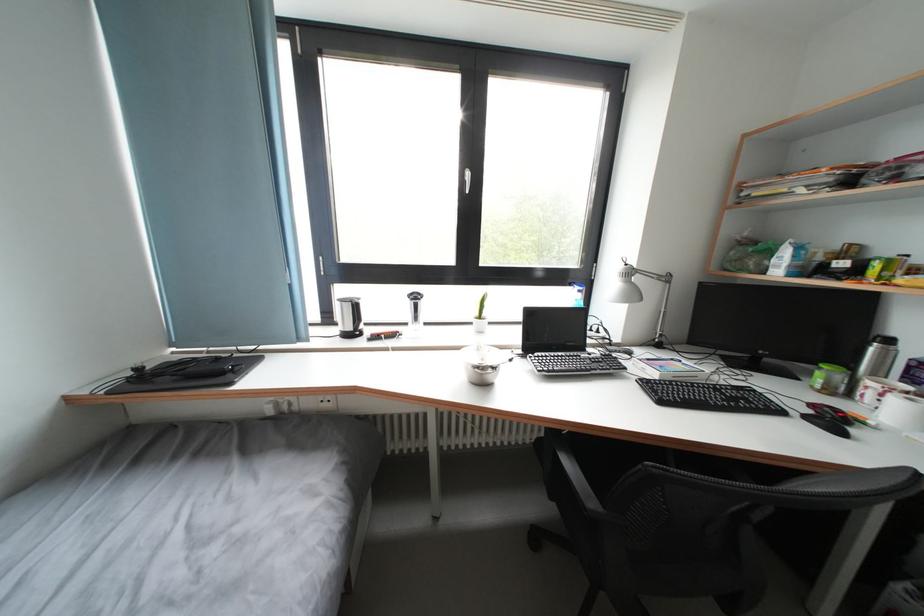
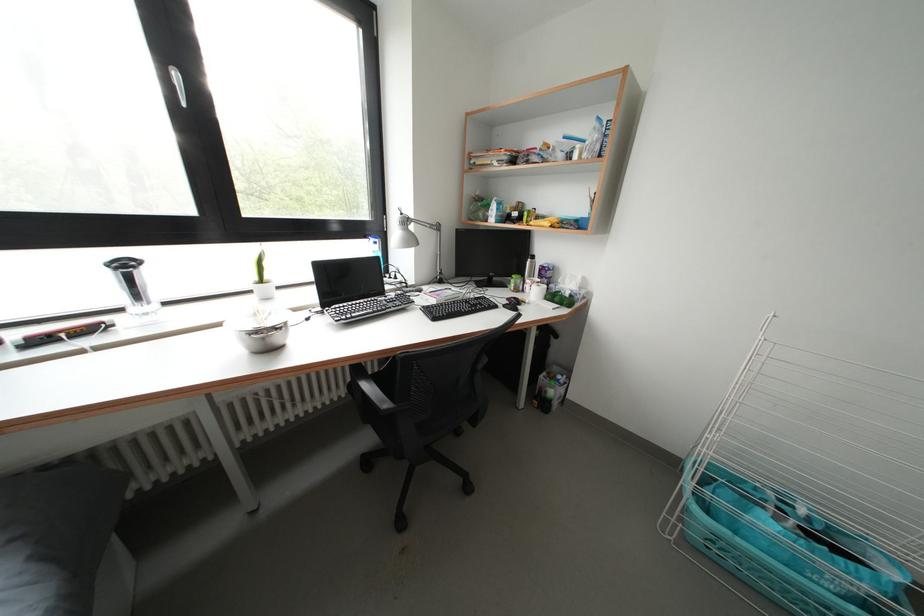
Find the pixel in the second image that matches the point at 820,411 in the first image.

(515, 304)